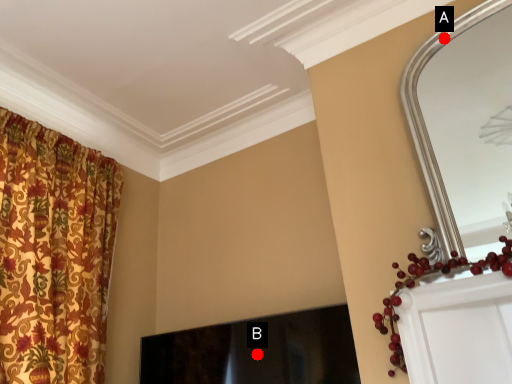
Question: Two points are circled on the image, labeled by A and B beside each circle. Which point is closer to the camera?

Choices:
 (A) A is closer
 (B) B is closer

Answer: (A)